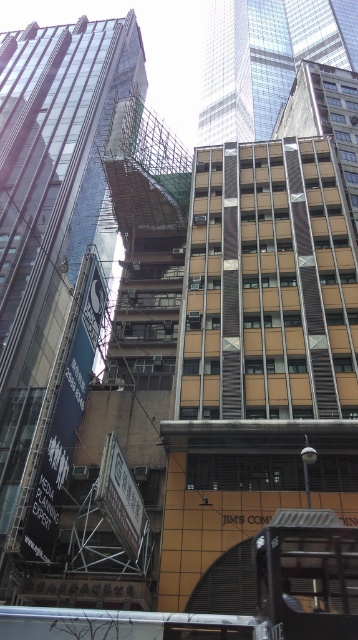
Question: Does brown textured building at center appear under glassy steel skyscraper at upper center?

Choices:
 (A) yes
 (B) no

Answer: (A)

Question: Which object is farther from the camera taking this photo?

Choices:
 (A) brown textured building at center
 (B) glassy steel skyscraper at upper center

Answer: (B)

Question: Can you confirm if brown textured building at center is wider than glassy steel skyscraper at upper center?

Choices:
 (A) no
 (B) yes

Answer: (A)

Question: Among these points, which one is farthest from the camera?

Choices:
 (A) (219, 10)
 (B) (6, 476)

Answer: (A)

Question: Does brown textured building at center appear on the right side of glassy steel skyscraper at upper center?

Choices:
 (A) no
 (B) yes

Answer: (A)